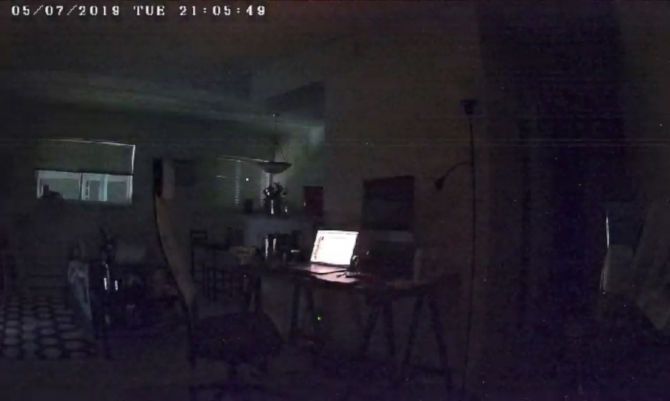
You are a GUI agent. You are given a task and a screenshot of the screen. Output one action in this format:
    pyautogui.click(x=<x>, y=<y>)
    Task: Click on the walls
    
    Given the screenshot: What is the action you would take?
    pyautogui.click(x=431, y=92), pyautogui.click(x=490, y=64)